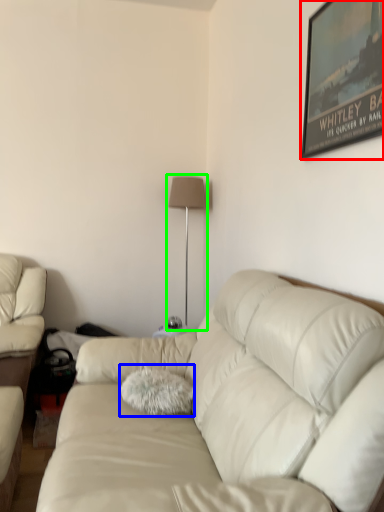
Question: Which is nearer to the picture frame (highlighted by a red box)? throw pillow (highlighted by a blue box) or table lamp (highlighted by a green box).

Choices:
 (A) throw pillow
 (B) table lamp

Answer: (A)